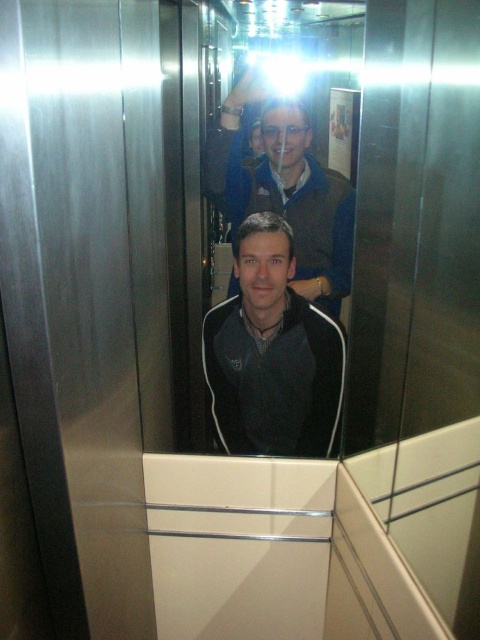
You are designing a new elevator interior and want to ensure there is enough space for passengers wearing jackets like the ones in the image. The black matte jacket at center and the matte black jacket at center are both present. Which jacket takes up more space in the elevator?

The matte black jacket at center takes up more space than the black matte jacket at center, as stated in the description.

From the picture: You are standing in the elevator and want to take a photo of both the black matte jacket at center and the matte black jacket at center. Which jacket should you focus on first to ensure both are in focus?

You should focus on the black matte jacket at center first since it is closer to the viewer than the matte black jacket at center, allowing both to be in focus when using a camera with a fixed focal point.

You are standing in an elevator with two people wearing jackets. The first person is wearing a black matte jacket at center, and the second is also wearing a matte black jacket at center. If you want to place a small gift between them, how far apart should you position it from each jacket?

The black matte jacket at center and matte black jacket at center are 16.65 inches apart from each other. To place the gift exactly between them, position it 8.325 inches away from each jacket.